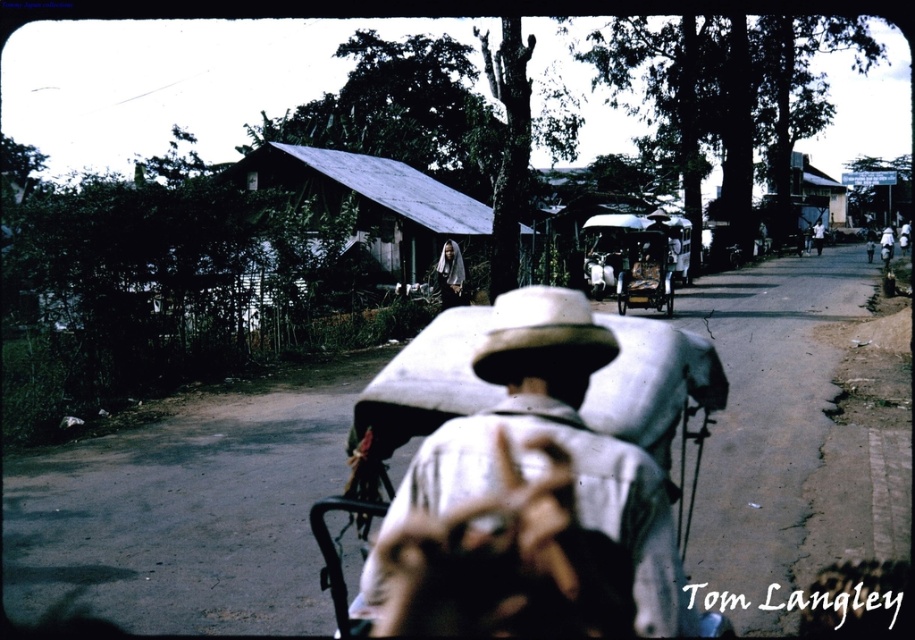
Question: Which of the following is the farthest from the observer?

Choices:
 (A) (442, 291)
 (B) (604, 502)
 (C) (327, 177)

Answer: (C)

Question: Can you confirm if metallic corrugated roof at center is wider than white fabric cowboy hat at center?

Choices:
 (A) yes
 (B) no

Answer: (A)

Question: Does metallic corrugated roof at center have a larger size compared to white fabric cowboy hat at center?

Choices:
 (A) yes
 (B) no

Answer: (A)

Question: Is metallic corrugated roof at center thinner than white fabric cowboy hat at center?

Choices:
 (A) yes
 (B) no

Answer: (B)

Question: Which object is closer to the camera taking this photo?

Choices:
 (A) metallic corrugated roof at center
 (B) white fabric cowboy hat at center
 (C) white matte hat at center

Answer: (C)

Question: Which point is closer to the camera?

Choices:
 (A) (546, 342)
 (B) (458, 256)
 (C) (414, 276)

Answer: (A)